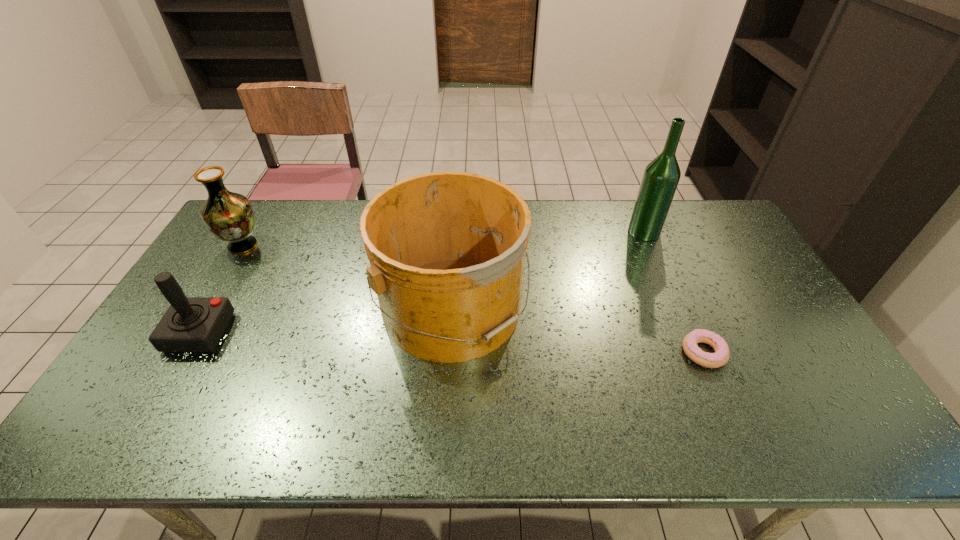
You are a GUI agent. You are given a task and a screenshot of the screen. Output one action in this format:
    pyautogui.click(x=<x>, y=<y>)
    Task: Click on the tallest object
    The height and width of the screenshot is (540, 960).
    Given the screenshot: What is the action you would take?
    pyautogui.click(x=661, y=176)

Where is `bucket`? The height and width of the screenshot is (540, 960). bucket is located at coordinates (447, 250).

Identify the location of vase. This screenshot has height=540, width=960. coord(229,216).

At what (x,y) coordinates should I click in order to perform the action: click on joystick. Please return your answer as a coordinate pair (x, y). The height and width of the screenshot is (540, 960). Looking at the image, I should click on (191, 324).

This screenshot has height=540, width=960. I want to click on doughnut, so click(x=720, y=357).

Where is `free space located on the back of the alcohol`? The image size is (960, 540). free space located on the back of the alcohol is located at coordinates (632, 203).

Identify the location of free region located on the right of the third object from left to right. This screenshot has height=540, width=960. (623, 307).

Where is `vacant space located 0.200m on the front of the third tallest object`? vacant space located 0.200m on the front of the third tallest object is located at coordinates (206, 306).

Locate an element on the screen. vacant position located 0.290m on the base of the second shortest object is located at coordinates (332, 333).

Identify the location of blank area located on the left of the shortest object. This screenshot has height=540, width=960. (640, 353).